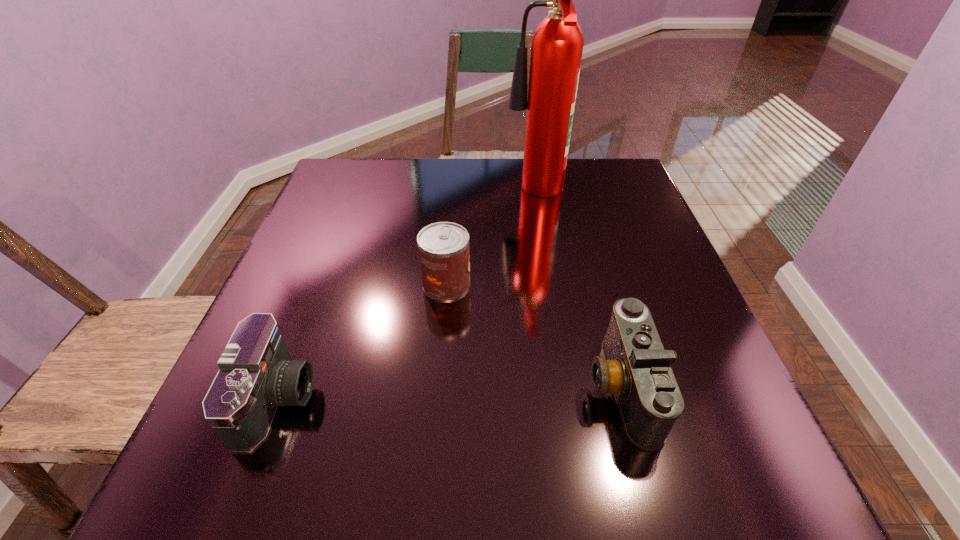
The width and height of the screenshot is (960, 540). I want to click on the farthest object, so click(557, 44).

The image size is (960, 540). What are the coordinates of `fire extinguisher` in the screenshot? It's located at (557, 44).

Find the location of a particular element. the second farthest object is located at coordinates (444, 253).

The width and height of the screenshot is (960, 540). I want to click on the second object from left to right, so tap(444, 253).

Locate an element on the screen. The width and height of the screenshot is (960, 540). the right camera is located at coordinates (637, 369).

Find the location of a particular element. the left camera is located at coordinates (256, 374).

In order to click on vacant space situated at the nozzle of the farthest object in this screenshot , I will do `click(448, 193)`.

What are the coordinates of `free space located 0.200m at the nozzle of the farthest object` in the screenshot? It's located at (429, 193).

The width and height of the screenshot is (960, 540). What are the coordinates of `vacant space located 0.310m at the nozzle of the farthest object` in the screenshot? It's located at (387, 193).

I want to click on vacant space located on the front of the second object from left to right, so click(x=429, y=499).